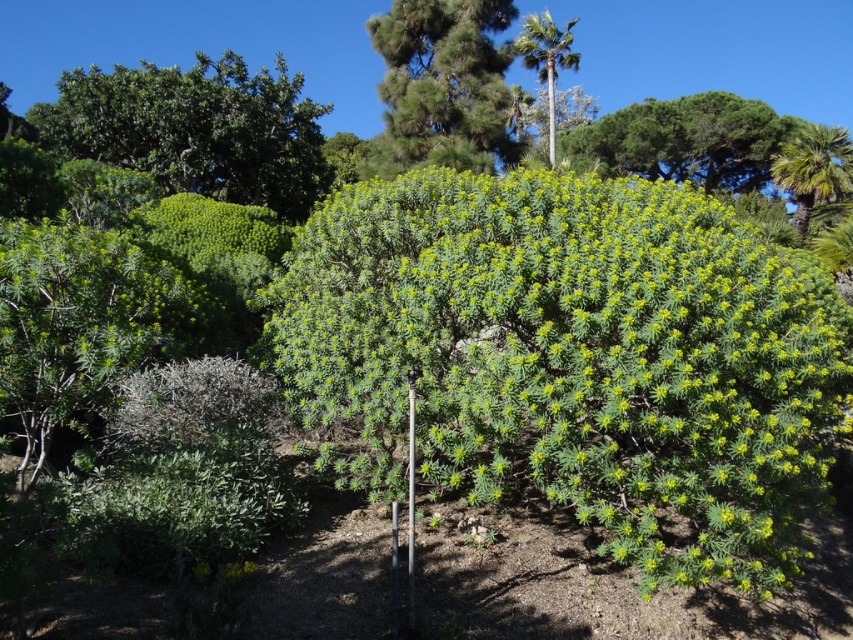
You are a gardener planning to plant both the green leafy bush at upper left and the green leafy palm at right in your garden. Based on their sizes, which one requires more space for proper growth?

The green leafy bush at upper left requires more space for proper growth because it has a larger size compared to the green leafy palm at right.

You are standing in the lush landscape and want to walk from point A to point B. Point A is at coordinates point (654, 120) and point B is at coordinates point (815, 164). Which point is closer to you when you start walking?

Point (815, 164) is closer to you because it is in front of point (654, 120), so you will reach point B first.

In the scene shown: You are standing in the middle of the landscape and want to take a photo of both the green leafy bush at upper left and the green leafy palm at right. Which object should you adjust your camera angle upwards to include in your photo?

You should adjust your camera angle upwards to include the green leafy bush at upper left because it is located above the green leafy palm at right.